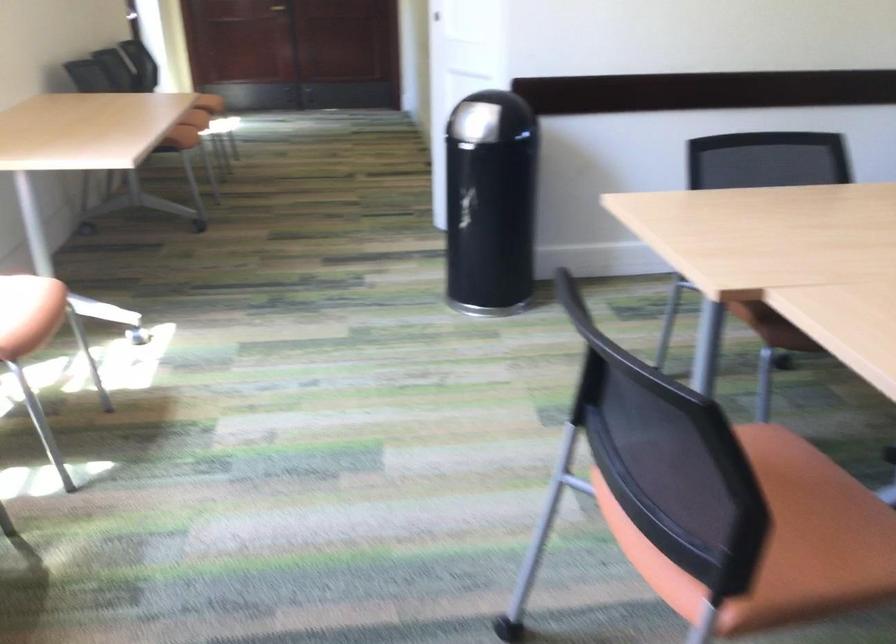
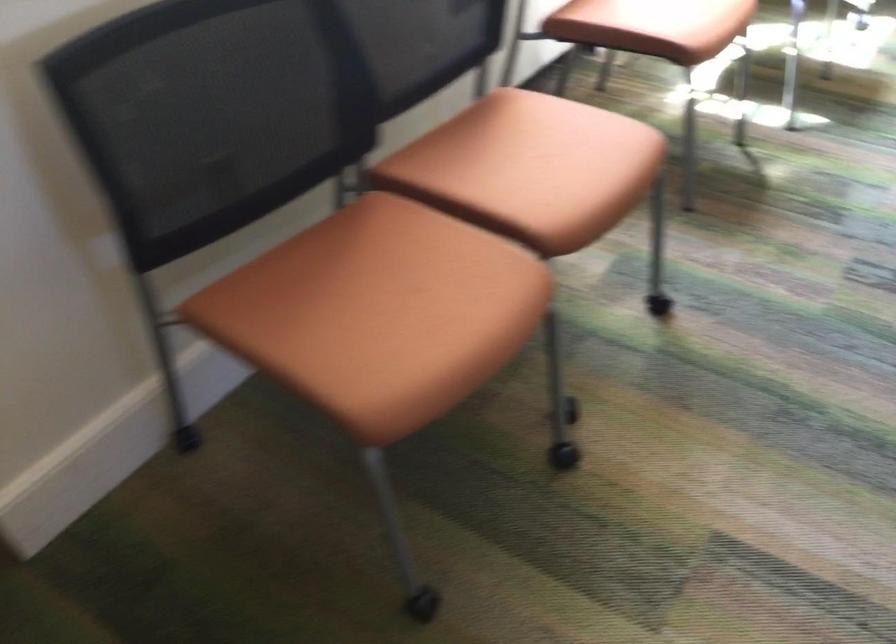
The images are taken continuously from a first-person perspective. In which direction is your viewpoint rotating?

The rotation direction of the camera is left-down.